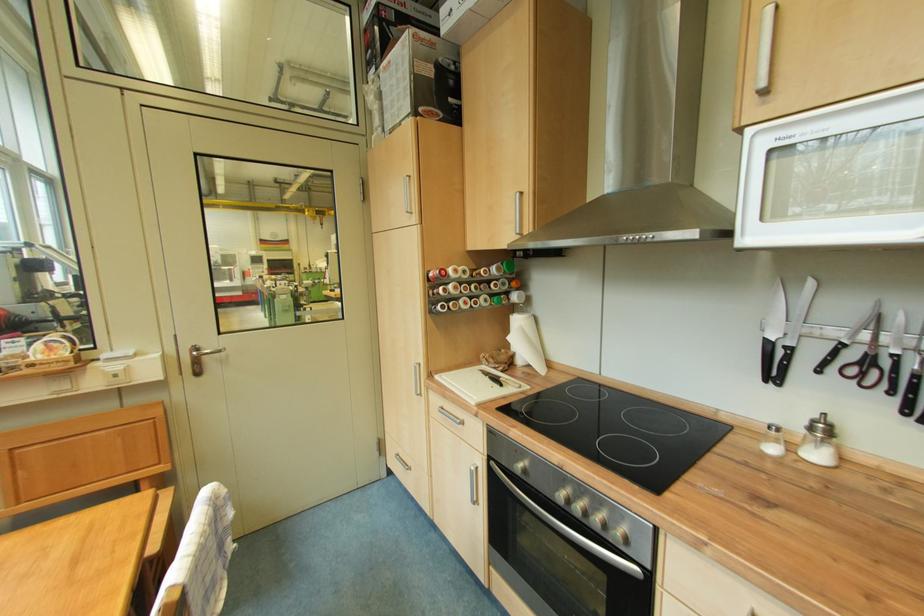
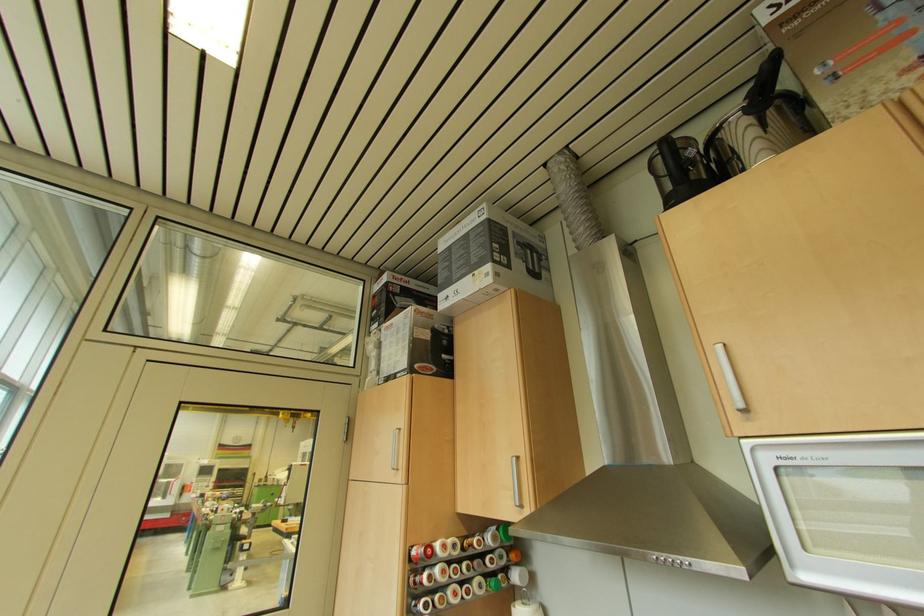
Where in the second image is the point corresponding to point 478,251 from the first image?

(468, 513)